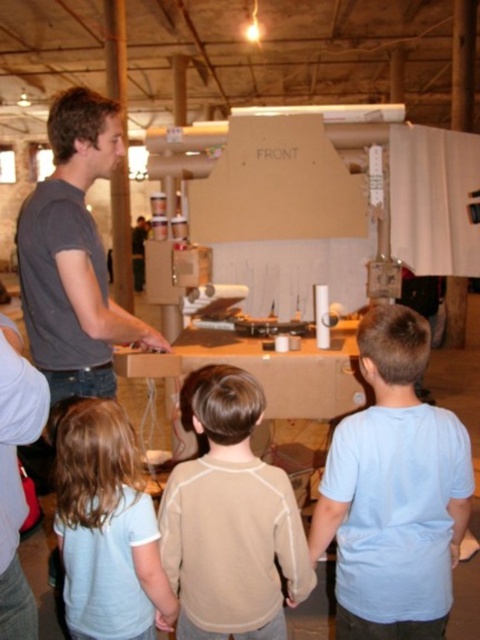
Between beige fleece sweater at center and light blue shirt at lower left, which one has more height?

Standing taller between the two is beige fleece sweater at center.

Based on the photo, does beige fleece sweater at center have a greater width compared to light blue shirt at lower left?

Yes.

Does point (294, 522) come behind point (108, 618)?

No, (294, 522) is in front of (108, 618).

Find the location of a particular element. The width and height of the screenshot is (480, 640). beige fleece sweater at center is located at coordinates (230, 516).

Is light blue cotton shirt at center bigger than beige fleece sweater at center?

Incorrect, light blue cotton shirt at center is not larger than beige fleece sweater at center.

Who is more distant from viewer, (375, 586) or (295, 568)?

Point (295, 568)

Identify the location of light blue cotton shirt at center. click(x=394, y=492).

Does light blue cotton shirt at center have a greater height compared to light blue shirt at lower left?

Yes, light blue cotton shirt at center is taller than light blue shirt at lower left.

Based on the photo, can you confirm if light blue cotton shirt at center is thinner than light blue shirt at lower left?

No.

Identify the location of light blue cotton shirt at center. This screenshot has height=640, width=480. (394, 492).